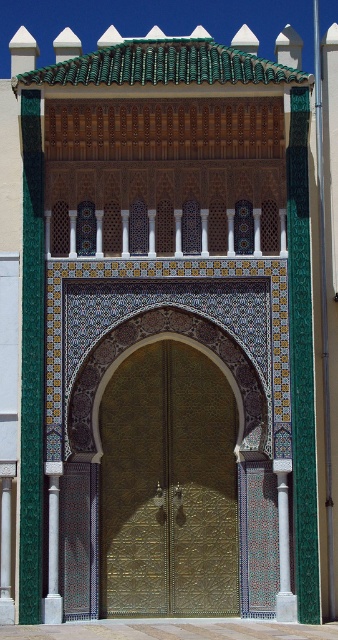
You are an architect designing a replica of this entrance. The space allocated for the replica is 25 feet wide. Considering the distance between the gold textured door at center and the white marble column at center, will the replica fit within the allocated space?

The distance between the gold textured door at center and the white marble column at center is 26.09 feet, which exceeds the 25 feet allocated space. Therefore, the replica will not fit within the allocated width.

You are standing in front of the entrance and want to locate the white marble column at center. According to the coordinates provided, where would you look?

You should look at point (283, 545) to find the white marble column at center.